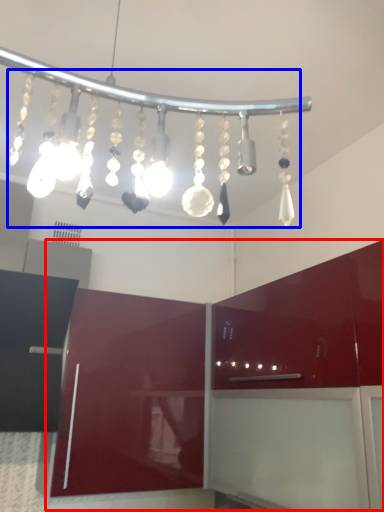
Question: Among these objects, which one is farthest to the camera, cabinetry (highlighted by a red box) or chandelier (highlighted by a blue box)?

Choices:
 (A) cabinetry
 (B) chandelier

Answer: (A)